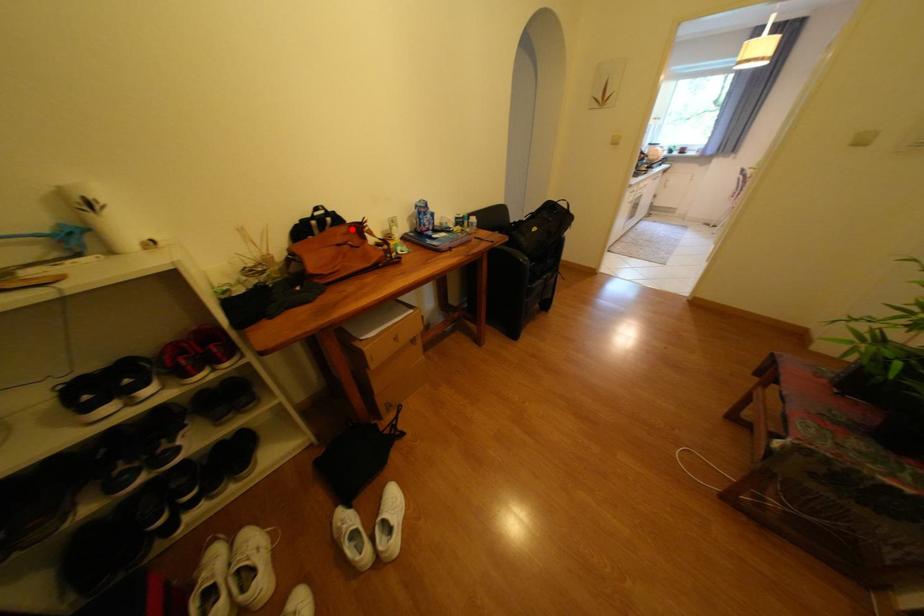
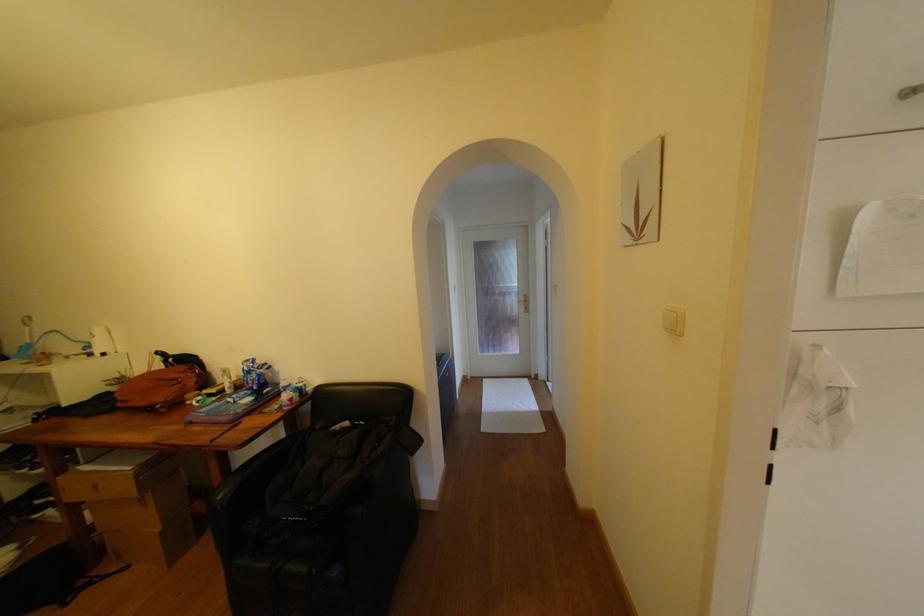
Question: I am providing you with two images of the same scene from different viewpoints. In image1, a red point is highlighted. Considering the same 3D point in image2, which of the following is correct?

Choices:
 (A) It is closer
 (B) It is farther

Answer: (B)